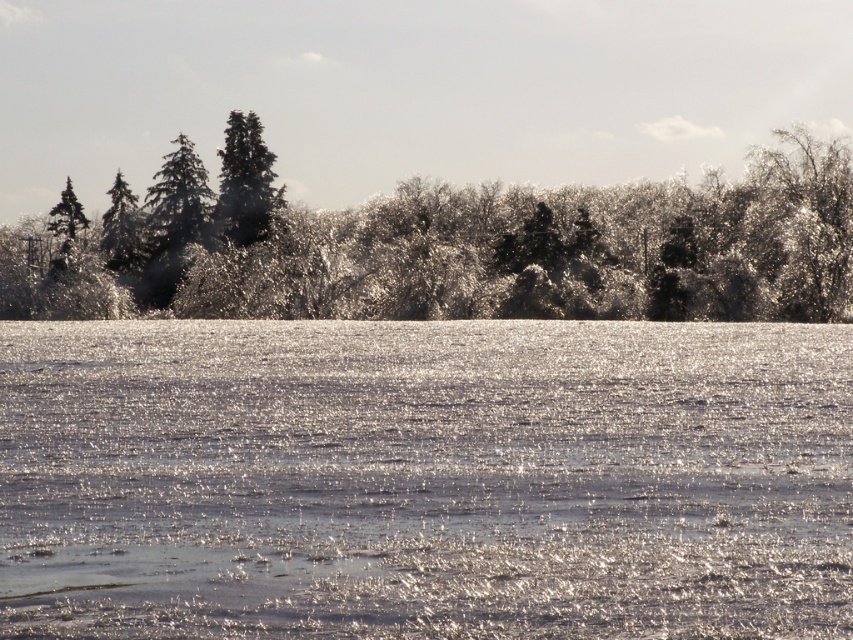
Between point (405, 429) and point (61, 192), which one is positioned behind?

The point (61, 192) is more distant.

Looking at this image, which is below, sparkling ice at center or green matte tree at upper left?

sparkling ice at center is below.

Which is behind, point (30, 330) or point (70, 209)?

Positioned behind is point (70, 209).

I want to click on sparkling ice at center, so click(x=424, y=477).

Is sparkling ice at center shorter than glossy evergreen trees at upper center?

Yes.

At what (x,y) coordinates should I click in order to perform the action: click on sparkling ice at center. Please return your answer as a coordinate pair (x, y). This screenshot has height=640, width=853. Looking at the image, I should click on (424, 477).

Is sparkling ice at center to the left of green matte tree at upper center from the viewer's perspective?

In fact, sparkling ice at center is to the right of green matte tree at upper center.

Consider the image. Is sparkling ice at center further to the viewer compared to green matte tree at upper center?

That is False.

Describe the element at coordinates (424, 477) in the screenshot. This screenshot has width=853, height=640. I see `sparkling ice at center` at that location.

You are a GUI agent. You are given a task and a screenshot of the screen. Output one action in this format:
    pyautogui.click(x=<x>, y=<y>)
    Task: Click on the sparkling ice at center
    This screenshot has width=853, height=640.
    Given the screenshot: What is the action you would take?
    pyautogui.click(x=424, y=477)